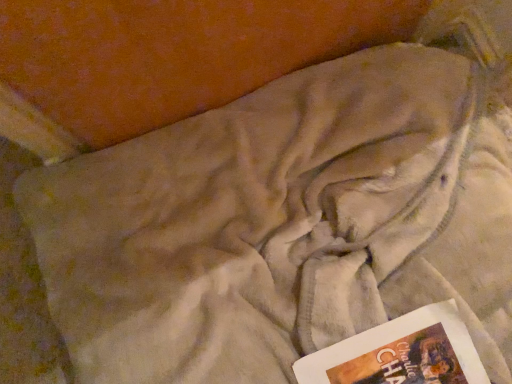
Locate an element on the screen. Image resolution: width=512 pixels, height=384 pixels. hardcover book at lower right is located at coordinates (400, 353).

What do you see at coordinates (400, 353) in the screenshot? I see `hardcover book at lower right` at bounding box center [400, 353].

Identify the location of hardcover book at lower right. The width and height of the screenshot is (512, 384). (400, 353).